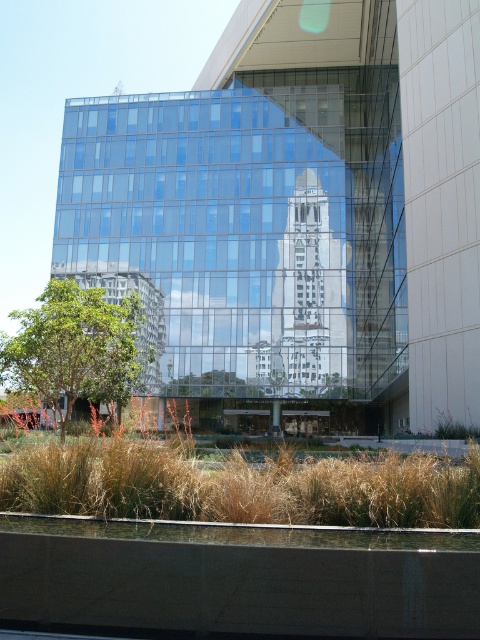
Looking at this image, who is lower down, transparent glass building at center or brown dry grass at lower center?

brown dry grass at lower center

In the scene shown: Does transparent glass building at center appear on the left side of brown dry grass at lower center?

No, transparent glass building at center is not to the left of brown dry grass at lower center.

Where is `transparent glass building at center`? Image resolution: width=480 pixels, height=640 pixels. transparent glass building at center is located at coordinates (299, 211).

Where is `transparent glass building at center`? transparent glass building at center is located at coordinates (299, 211).